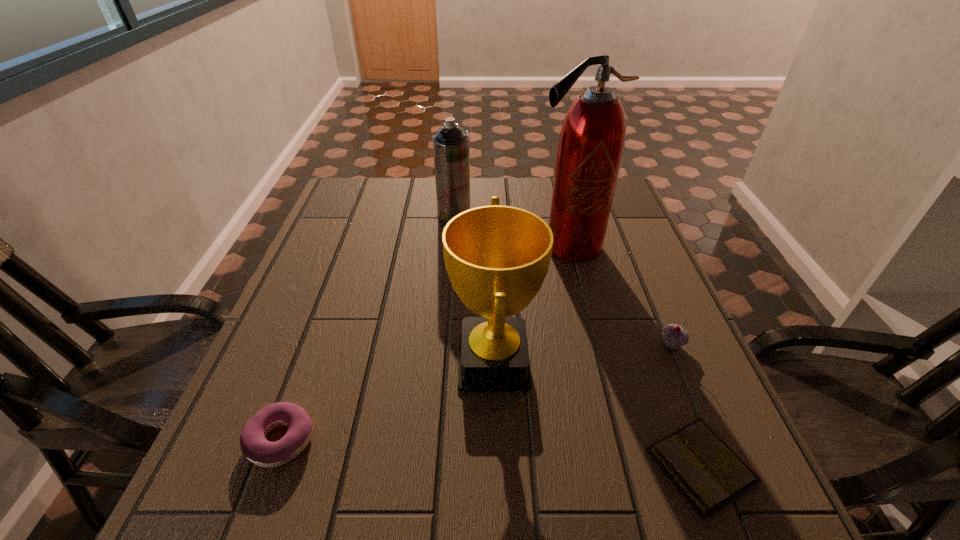
Find the location of a particular element. This screenshot has height=540, width=960. free space located on the front-facing side of the award is located at coordinates (364, 362).

The height and width of the screenshot is (540, 960). What are the coordinates of `vacant space located 0.210m on the front-facing side of the award` in the screenshot? It's located at (349, 362).

Image resolution: width=960 pixels, height=540 pixels. In order to click on vacant region located on the front of the aerosol can in this screenshot , I will do point(452,242).

The width and height of the screenshot is (960, 540). Identify the location of vacant region located 0.120m on the left of the cupcake. (603, 344).

Identify the location of free space located 0.170m on the right of the fifth tallest object. The width and height of the screenshot is (960, 540). (410, 440).

Image resolution: width=960 pixels, height=540 pixels. I want to click on free space located on the left of the shortest object, so click(591, 465).

Locate an element on the screen. The image size is (960, 540). object that is at the far edge is located at coordinates (451, 152).

The image size is (960, 540). I want to click on object situated at the near edge, so click(x=705, y=469).

The height and width of the screenshot is (540, 960). Identify the location of object positioned at the left edge. (255, 447).

I want to click on fire extinguisher that is at the right edge, so click(592, 138).